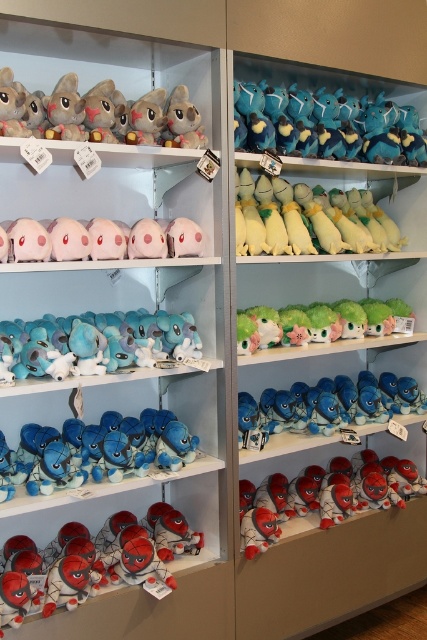
Question: Does matte blue plush at center have a greater width compared to yellow plush duck at center?

Choices:
 (A) yes
 (B) no

Answer: (B)

Question: Estimate the real-world distances between objects in this image. Which object is farther from the blue plush toy at upper center?

Choices:
 (A) yellow plush duck at center
 (B) soft plush toy at center
 (C) green plush toy at center

Answer: (B)

Question: Can you confirm if matte blue plush at center is positioned to the right of yellow plush duck at center?

Choices:
 (A) no
 (B) yes

Answer: (A)

Question: Which of these objects is positioned closest to the matte blue plush at center?

Choices:
 (A) blue plush toy at upper center
 (B) pink plush toy at center
 (C) soft plush toy at center

Answer: (C)

Question: Which point is farther to the camera?

Choices:
 (A) blue plush toy at center
 (B) soft plush toy at center
 (C) matte red plush toy at lower left

Answer: (A)

Question: Does soft plush toy at center appear over yellow plush duck at center?

Choices:
 (A) no
 (B) yes

Answer: (A)